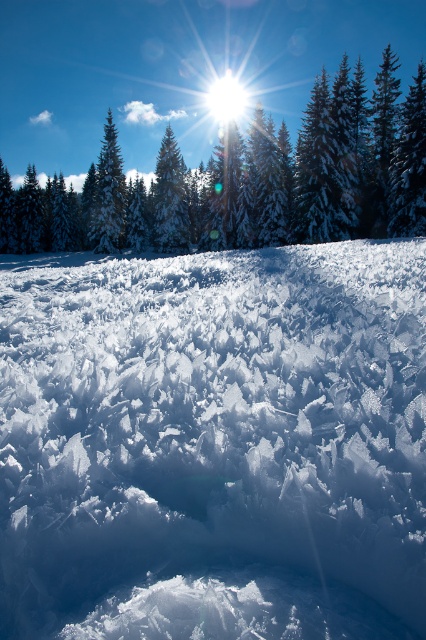
You are an observer looking at the winter scene. You notice the white crystalline snow at center and the green matte tree at upper center. Which object is positioned nearer to you?

The white crystalline snow at center is closer to the viewer than the green matte tree at upper center.

You are an artist trying to paint this winter scene. You notice the white crystalline snow at center and the green matte tree at upper center. Which object in the scene has a smaller width?

The white crystalline snow at center has a lesser width compared to the green matte tree at upper center.